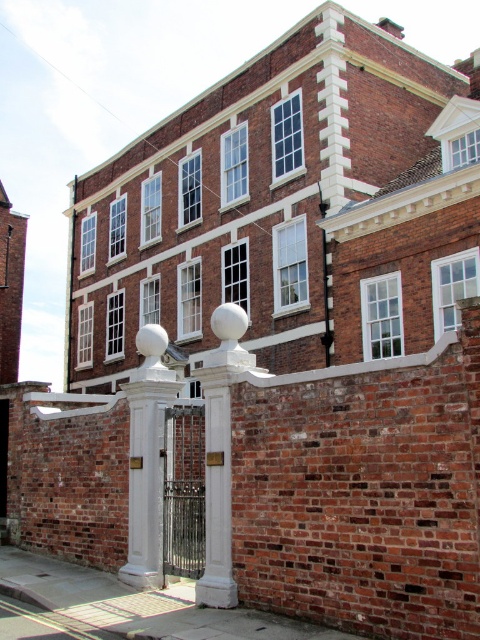
Question: Does white polished stone pillar at center appear under white glossy pillar at center?

Choices:
 (A) yes
 (B) no

Answer: (A)

Question: Is white polished stone pillar at center to the left of white glossy pillar at center from the viewer's perspective?

Choices:
 (A) yes
 (B) no

Answer: (A)

Question: Does white polished stone pillar at center appear on the left side of white glossy pillar at center?

Choices:
 (A) yes
 (B) no

Answer: (A)

Question: Among these objects, which one is nearest to the camera?

Choices:
 (A) white glossy pillar at center
 (B) white polished stone pillar at center

Answer: (A)

Question: Which object appears farthest from the camera in this image?

Choices:
 (A) white polished stone pillar at center
 (B) white glossy pillar at center

Answer: (A)